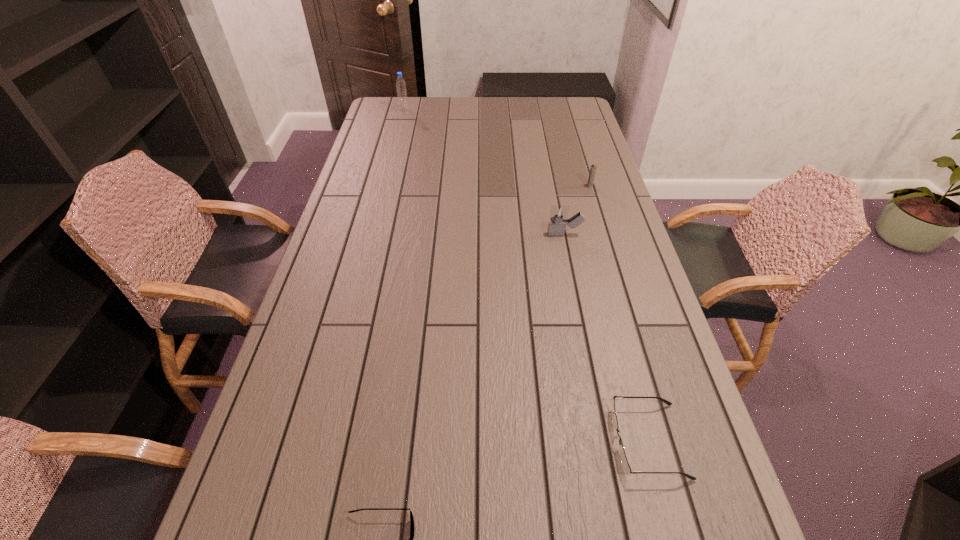
You are a GUI agent. You are given a task and a screenshot of the screen. Output one action in this format:
    pyautogui.click(x=<x>, y=<y>)
    Task: Click on the tallest object
    The height and width of the screenshot is (540, 960).
    Given the screenshot: What is the action you would take?
    pyautogui.click(x=400, y=83)

Find the location of `water bottle`. water bottle is located at coordinates (400, 83).

What are the coordinates of `the nearer igniter` in the screenshot? It's located at (556, 227).

Locate an element on the screen. Image resolution: width=960 pixels, height=540 pixels. the taller igniter is located at coordinates (556, 227).

Image resolution: width=960 pixels, height=540 pixels. Identify the location of the third shortest object. (593, 168).

This screenshot has width=960, height=540. I want to click on the farther igniter, so click(593, 168).

This screenshot has height=540, width=960. I want to click on the right spectacles, so click(x=627, y=469).

This screenshot has height=540, width=960. What are the coordinates of `the fourth farthest object` in the screenshot? It's located at (627, 469).

I want to click on vacant space situated 0.070m on the right of the leftmost object, so click(x=424, y=110).

The height and width of the screenshot is (540, 960). I want to click on free region located 0.350m on the back of the left igniter, so click(x=551, y=167).